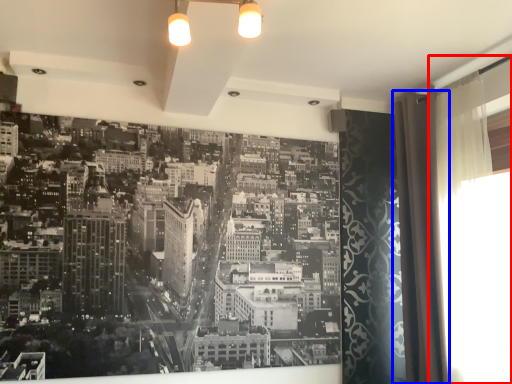
Question: Which object appears closest to the camera in this image, window screen (highlighted by a red box) or shower curtain (highlighted by a blue box)?

Choices:
 (A) window screen
 (B) shower curtain

Answer: (A)